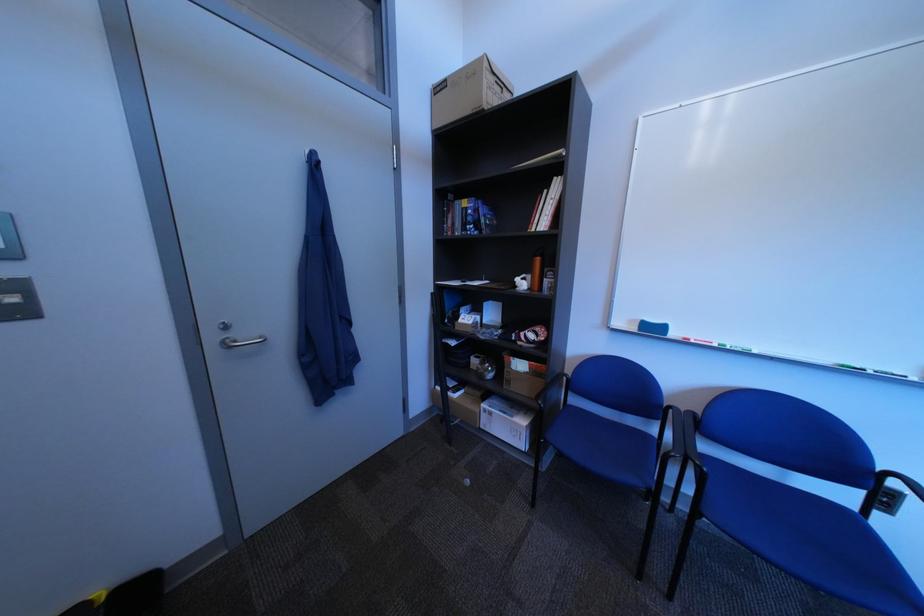
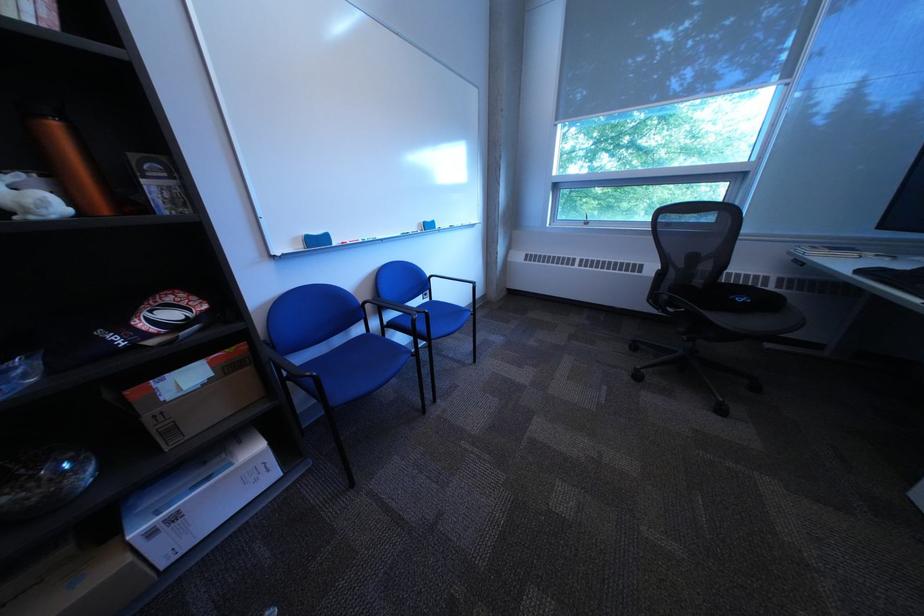
The first image is from the beginning of the video and the second image is from the end. How did the camera likely rotate when shooting the video?

The camera rotated toward right-down.